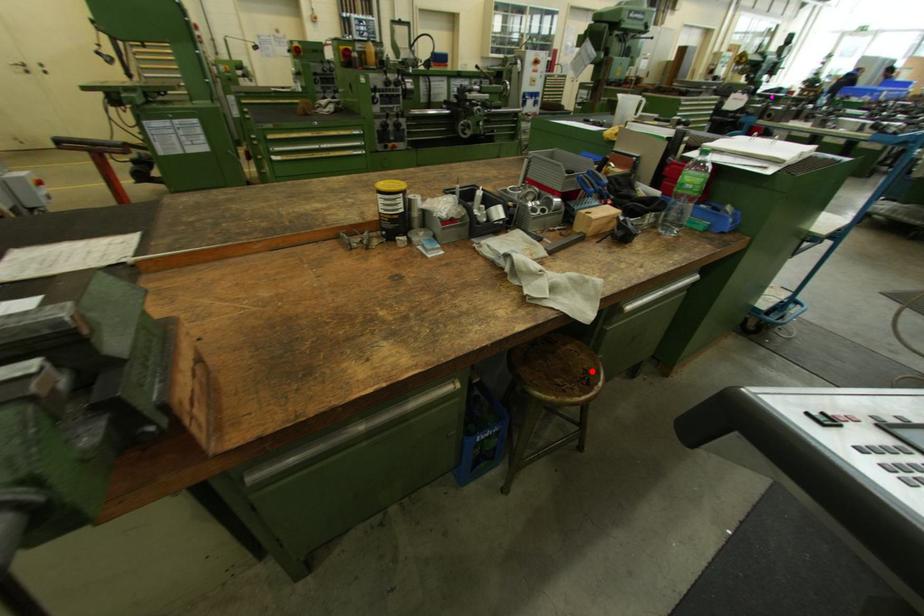
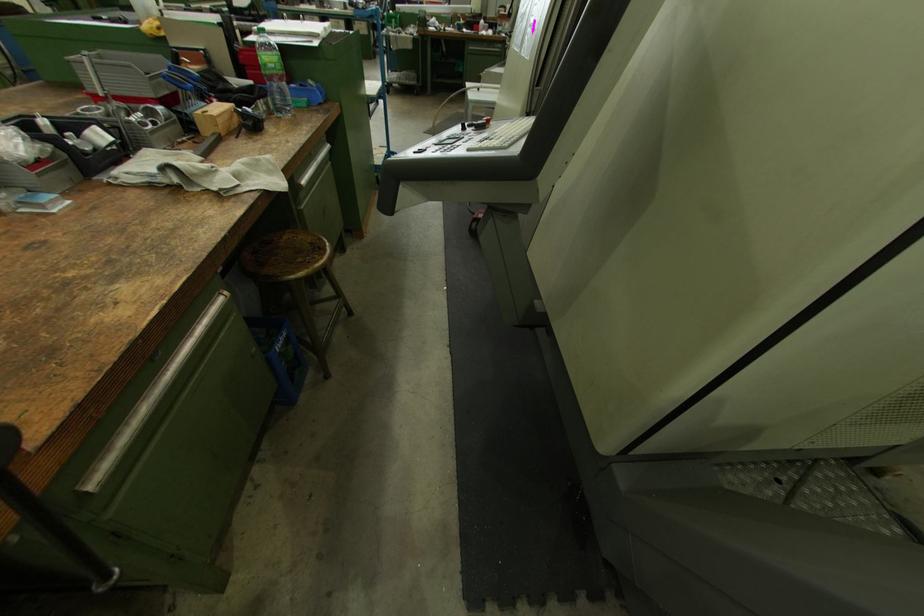
The point at the highlighted location is marked in the first image. Where is the corresponding point in the second image?

(317, 244)